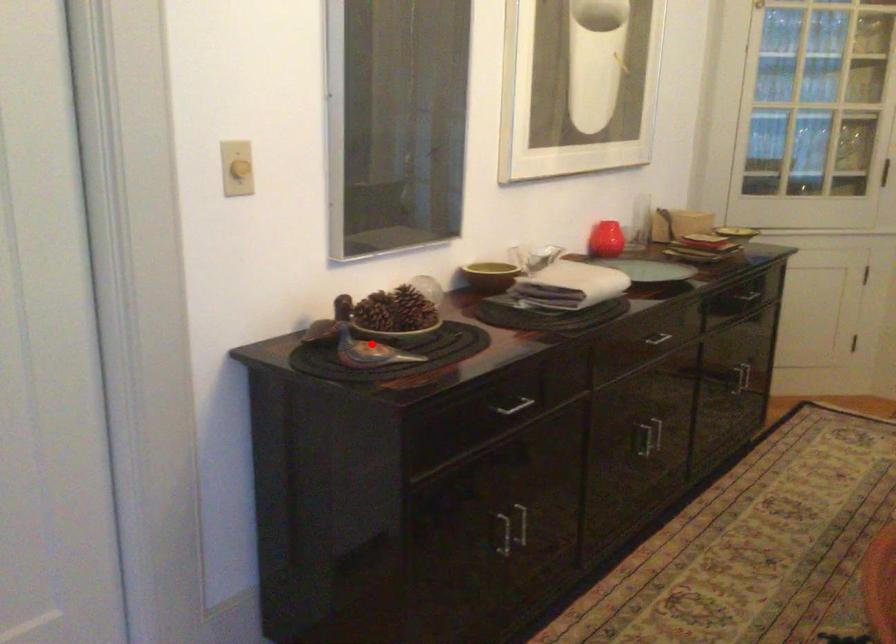
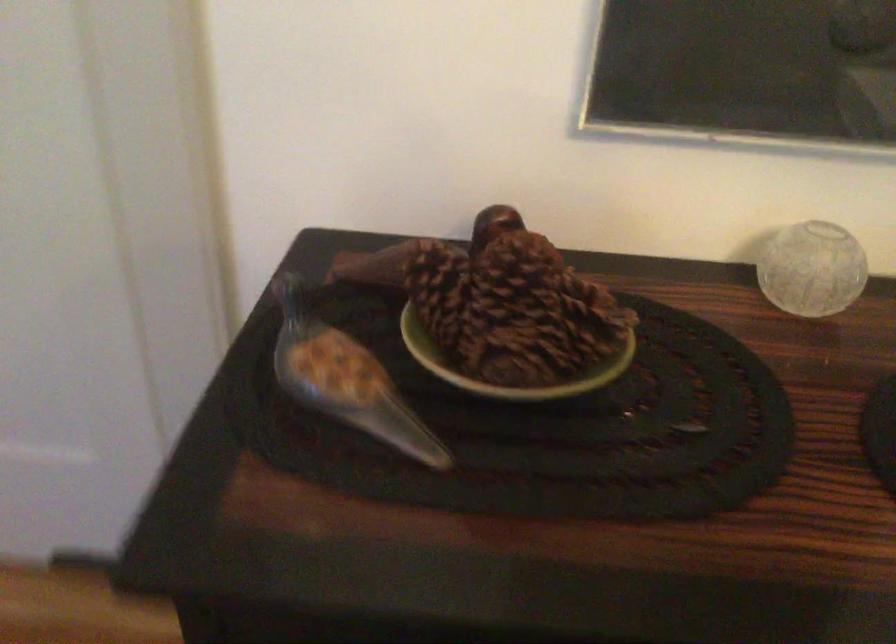
Question: A red point is marked in image1. In image2, is the corresponding 3D point closer to the camera or farther? Reply with the corresponding letter.

Choices:
 (A) The corresponding 3D point is closer.
 (B) The corresponding 3D point is farther.

Answer: (A)